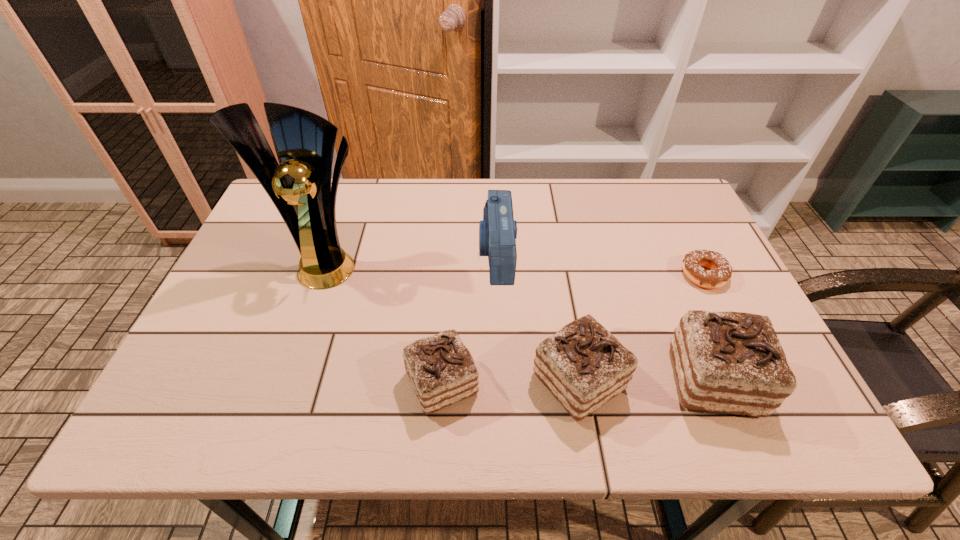
In order to click on free spot located on the back of the third object from right to left in this screenshot , I will do `click(559, 268)`.

This screenshot has width=960, height=540. What are the coordinates of `free point located on the left of the rightmost chocolate cake` in the screenshot? It's located at (612, 380).

This screenshot has width=960, height=540. Identify the location of vacant space located on the back of the shortest object. (662, 190).

At what (x,y) coordinates should I click in order to perform the action: click on vacant space located at the front of the leftmost object, where the globe is visible. Please return your answer as a coordinate pair (x, y). This screenshot has width=960, height=540. Looking at the image, I should click on (309, 315).

This screenshot has height=540, width=960. I want to click on vacant space situated on the lens of the camera, so pyautogui.click(x=405, y=254).

You are a GUI agent. You are given a task and a screenshot of the screen. Output one action in this format:
    pyautogui.click(x=<x>, y=<y>)
    Task: Click on the vacant space located on the lens of the camera
    
    Given the screenshot: What is the action you would take?
    pyautogui.click(x=347, y=254)

Locate an element on the screen. The width and height of the screenshot is (960, 540). blank area located on the lens of the camera is located at coordinates (365, 254).

At what (x,y) coordinates should I click in order to perform the action: click on object present at the far edge. Please return your answer as a coordinate pair (x, y). The image size is (960, 540). Looking at the image, I should click on (498, 231).

Where is `object at the left edge`? object at the left edge is located at coordinates (300, 187).

Where is `chocolate cake positioned at the right edge`? The width and height of the screenshot is (960, 540). chocolate cake positioned at the right edge is located at coordinates (733, 362).